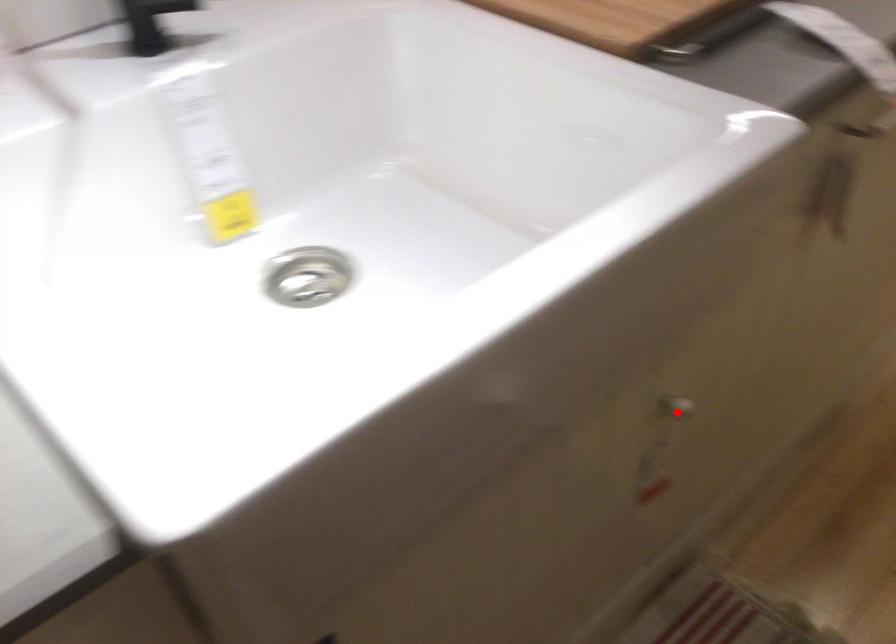
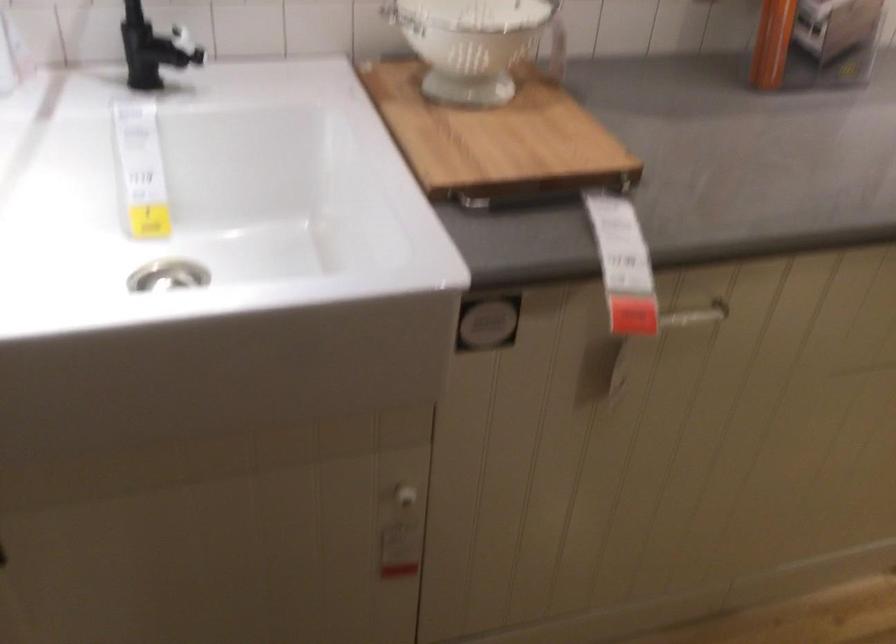
The point at the highlighted location is marked in the first image. Where is the corresponding point in the second image?

(403, 497)